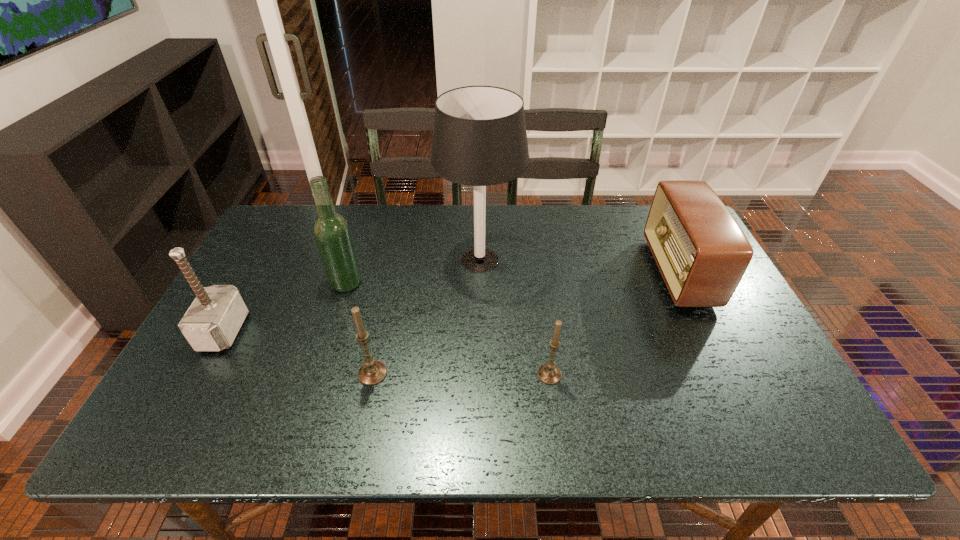
Locate an element on the screen. empty location between the radio receiver and the shortest object is located at coordinates (613, 323).

Locate an element on the screen. object that is the fourth closest one to the fifth shortest object is located at coordinates (549, 373).

Choose which object is the second nearest neighbor to the fifth object from right to left. Please provide its 2D coordinates. Your answer should be formatted as a tuple, i.e. [(x, y)], where the tuple contains the x and y coordinates of a point satisfying the conditions above.

[(479, 139)]

You are a GUI agent. You are given a task and a screenshot of the screen. Output one action in this format:
    pyautogui.click(x=<x>, y=<y>)
    Task: Click on the free location that satisfies the following two spatial constraints: 1. on the front side of the fifth object from right to left; 2. for striking with the head of the third tallest object
    
    Given the screenshot: What is the action you would take?
    pyautogui.click(x=330, y=331)

Identify the location of free space in the image that satisfies the following two spatial constraints: 1. for striking with the head of the leftmost object; 2. on the back side of the fifth object from left to right. (200, 375).

Locate an element on the screen. This screenshot has height=540, width=960. free space that satisfies the following two spatial constraints: 1. on the front side of the taller candle; 2. on the left side of the right candle is located at coordinates (372, 375).